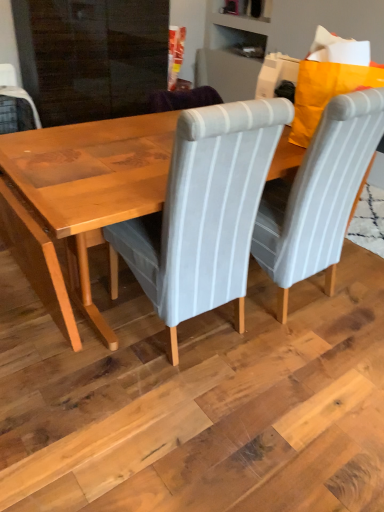
Where is `light gray fabric chair at center, the 2th chair from the right`? light gray fabric chair at center, the 2th chair from the right is located at coordinates (203, 213).

I want to click on gray striped fabric chair at center, which ranks as the second chair in left-to-right order, so click(x=318, y=195).

From a real-world perspective, between gray striped fabric chair at center, the 1th chair in the right-to-left sequence, and wooden table at center, who is vertically lower?

In real-world perspective, wooden table at center is lower.

Considering the positions of points (289, 222) and (76, 227), is point (289, 222) farther from camera compared to point (76, 227)?

Yes, it is behind point (76, 227).

Identify the location of table that is on the left side of gray striped fabric chair at center, which ranks as the second chair in left-to-right order. The width and height of the screenshot is (384, 512). (80, 200).

In terms of height, does gray striped fabric chair at center, which ranks as the second chair in left-to-right order, look taller or shorter compared to wooden table at center?

Clearly, gray striped fabric chair at center, which ranks as the second chair in left-to-right order, is taller compared to wooden table at center.

Considering the positions of objects light gray fabric chair at center, the 1th chair positioned from the left, and wooden table at center in the image provided, who is more to the left, light gray fabric chair at center, the 1th chair positioned from the left, or wooden table at center?

light gray fabric chair at center, the 1th chair positioned from the left, is more to the left.

Is wooden table at center at the back of light gray fabric chair at center, the 2th chair from the right?

That's not correct — light gray fabric chair at center, the 2th chair from the right, is not looking away from wooden table at center.

Looking at the image, does light gray fabric chair at center, the 2th chair from the right, seem bigger or smaller compared to wooden table at center?

light gray fabric chair at center, the 2th chair from the right, is smaller than wooden table at center.

Is wooden table at center turned away from light gray fabric chair at center, the 2th chair from the right?

No.

Which is correct: wooden table at center is inside light gray fabric chair at center, the 1th chair positioned from the left, or outside of it?

wooden table at center is not enclosed by light gray fabric chair at center, the 1th chair positioned from the left.

I want to click on the 1st chair behind the wooden table at center, so click(x=203, y=213).

Based on the photo, are gray striped fabric chair at center, which ranks as the second chair in left-to-right order, and light gray fabric chair at center, the 1th chair positioned from the left, beside each other?

gray striped fabric chair at center, which ranks as the second chair in left-to-right order, is not next to light gray fabric chair at center, the 1th chair positioned from the left, and they're not touching.

You are a GUI agent. You are given a task and a screenshot of the screen. Output one action in this format:
    pyautogui.click(x=<x>, y=<y>)
    Task: Click on the chair above the light gray fabric chair at center, the 2th chair from the right (from the image's perspective)
    This screenshot has width=384, height=512.
    Given the screenshot: What is the action you would take?
    pyautogui.click(x=318, y=195)

Which is closer to the camera, (289, 197) or (246, 143)?

Positioned in front is point (246, 143).

Relative to gray striped fabric chair at center, which ranks as the second chair in left-to-right order, is wooden table at center in front or behind?

In the image, wooden table at center appears in front of gray striped fabric chair at center, which ranks as the second chair in left-to-right order.

The height and width of the screenshot is (512, 384). I want to click on the 2nd chair positioned above the wooden table at center (from the image's perspective), so click(318, 195).

Would you say wooden table at center is to the left or to the right of gray striped fabric chair at center, the 1th chair in the right-to-left sequence, in the picture?

wooden table at center is positioned on gray striped fabric chair at center, the 1th chair in the right-to-left sequence,'s left side.

Considering the sizes of wooden table at center and gray striped fabric chair at center, which ranks as the second chair in left-to-right order, in the image, is wooden table at center taller or shorter than gray striped fabric chair at center, which ranks as the second chair in left-to-right order,?

Clearly, wooden table at center is shorter compared to gray striped fabric chair at center, which ranks as the second chair in left-to-right order.

How much distance is there between light gray fabric chair at center, the 2th chair from the right, and gray striped fabric chair at center, which ranks as the second chair in left-to-right order?

light gray fabric chair at center, the 2th chair from the right, and gray striped fabric chair at center, which ranks as the second chair in left-to-right order, are 15.71 inches apart.

I want to click on chair above the light gray fabric chair at center, the 2th chair from the right (from the image's perspective), so 318,195.

From the picture: Can you confirm if light gray fabric chair at center, the 2th chair from the right, is wider than gray striped fabric chair at center, the 1th chair in the right-to-left sequence?

Indeed, light gray fabric chair at center, the 2th chair from the right, has a greater width compared to gray striped fabric chair at center, the 1th chair in the right-to-left sequence.

Which is closer to the camera, (247,166) or (327,241)?

Point (247,166).

From the image's perspective, starting from the wooden table at center, which chair is the 2nd one above? Please provide its 2D coordinates.

[(318, 195)]

At what (x,y) coordinates should I click in order to perform the action: click on chair to the left of wooden table at center. Please return your answer as a coordinate pair (x, y). The width and height of the screenshot is (384, 512). Looking at the image, I should click on (203, 213).

Based on their spatial positions, is wooden table at center or gray striped fabric chair at center, which ranks as the second chair in left-to-right order, closer to light gray fabric chair at center, the 1th chair positioned from the left?

wooden table at center.

Looking at this image, estimate the real-world distances between objects in this image. Which object is closer to wooden table at center, light gray fabric chair at center, the 2th chair from the right, or gray striped fabric chair at center, which ranks as the second chair in left-to-right order?

Based on the image, light gray fabric chair at center, the 2th chair from the right, appears to be nearer to wooden table at center.

Estimate the real-world distances between objects in this image. Which object is further from gray striped fabric chair at center, the 1th chair in the right-to-left sequence, light gray fabric chair at center, the 1th chair positioned from the left, or wooden table at center?

Among the two, wooden table at center is located further to gray striped fabric chair at center, the 1th chair in the right-to-left sequence.

Based on their spatial positions, is wooden table at center or light gray fabric chair at center, the 1th chair positioned from the left, closer to gray striped fabric chair at center, which ranks as the second chair in left-to-right order?

light gray fabric chair at center, the 1th chair positioned from the left, is positioned closer to the anchor gray striped fabric chair at center, which ranks as the second chair in left-to-right order.

Considering their positions, is gray striped fabric chair at center, which ranks as the second chair in left-to-right order, positioned closer to wooden table at center than light gray fabric chair at center, the 2th chair from the right?

light gray fabric chair at center, the 2th chair from the right, is closer to wooden table at center.

Looking at the image, which one is located further to light gray fabric chair at center, the 1th chair positioned from the left, gray striped fabric chair at center, the 1th chair in the right-to-left sequence, or wooden table at center?

Among the two, gray striped fabric chair at center, the 1th chair in the right-to-left sequence, is located further to light gray fabric chair at center, the 1th chair positioned from the left.

Where is `chair between wooden table at center and gray striped fabric chair at center, the 1th chair in the right-to-left sequence, from front to back`? The width and height of the screenshot is (384, 512). chair between wooden table at center and gray striped fabric chair at center, the 1th chair in the right-to-left sequence, from front to back is located at coordinates (203, 213).